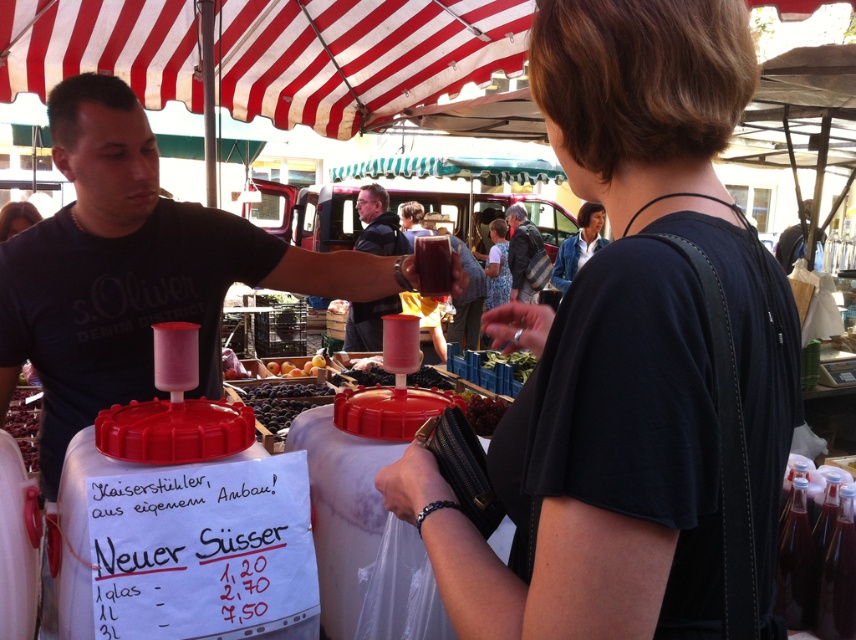
You are a customer standing at the vendor table in the market. You see two points marked on the table surface. The first point is at coordinate (x=563, y=275) and the second is at (x=801, y=244). Which point is closer to you?

Point (x=563, y=275) is closer to you because it is further to the camera than point (x=801, y=244).

You are a customer at the market and want to buy a jacket. The vendor is wearing a matte black shirt at upper left and has a blue denim jacket at upper center. Which item is higher up in the image?

The blue denim jacket at upper center is located above the matte black shirt at upper left, so it is higher up in the image.